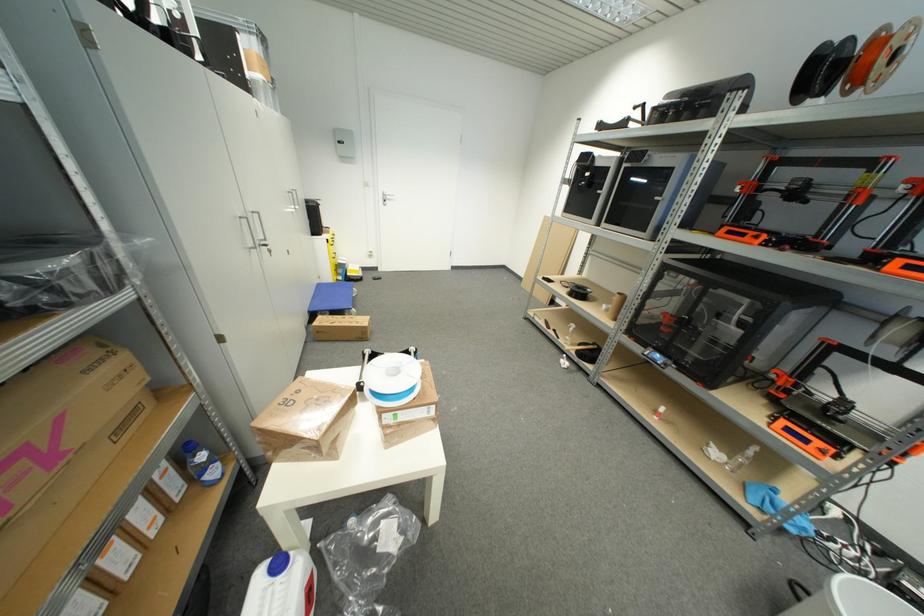
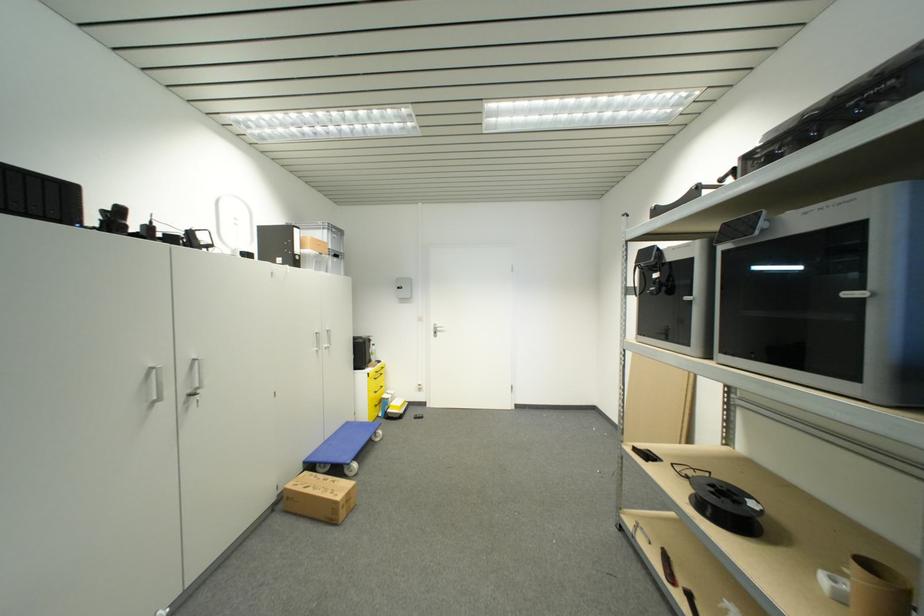
How did the camera likely rotate?

The rotation direction of the camera is left-up.